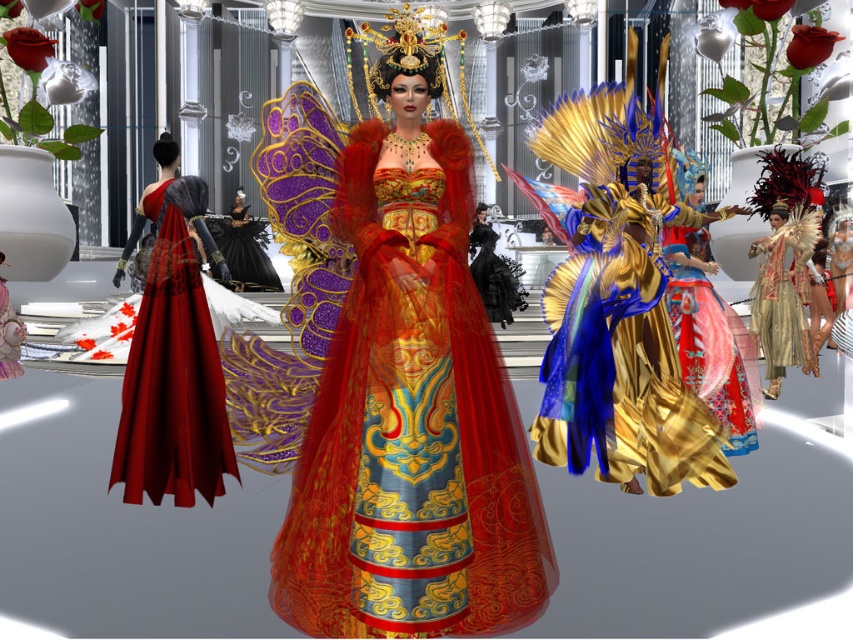
You are a photographer at the fashion show. You want to take a closeup shot of the shiny gold fabric dress at center. The point you are focusing on is at coordinates point (618, 349). Based on the scene description, can you confirm if this point is on the dress?

Yes, the point (618, 349) is on the shiny gold fabric dress at center according to the description.

You are a photographer adjusting your camera settings to capture the central figure in the vibrant and fantastical scene. You notice two points marked as point (573, 360) and point (786, 284) on the central figure. Which point is closer to the camera?

Point (573, 360) is closer to the camera than point (786, 284).